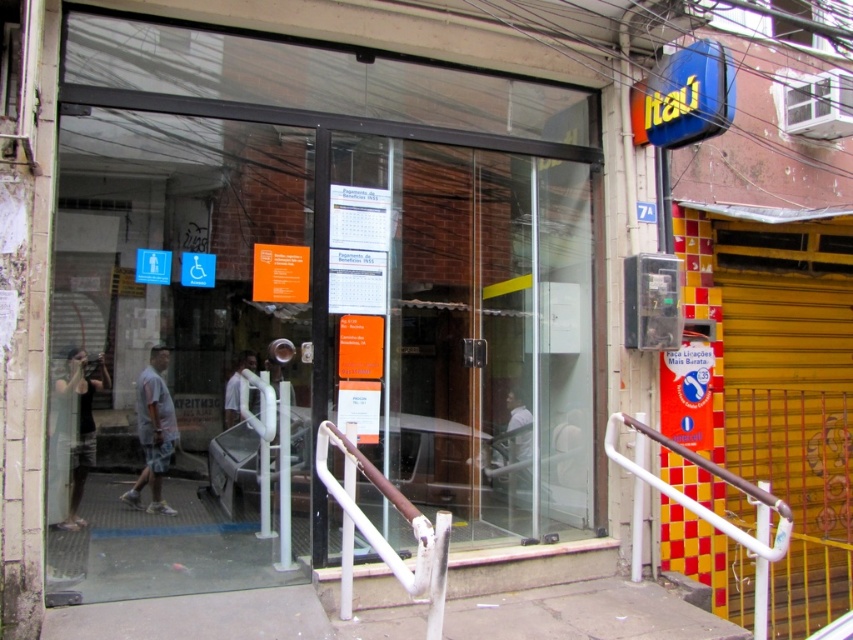
Question: Is white metal handrail at lower right positioned in front of white matte shirt at center?

Choices:
 (A) no
 (B) yes

Answer: (B)

Question: Is transparent glass door at center above white metal handrail at lower right?

Choices:
 (A) no
 (B) yes

Answer: (B)

Question: Which of the following is the closest to the observer?

Choices:
 (A) gray cotton shorts at lower left
 (B) white metal handrail at lower right

Answer: (B)

Question: Which of the following is the closest to the observer?

Choices:
 (A) click(x=151, y=376)
 (B) click(x=223, y=397)

Answer: (A)

Question: Does transparent glass door at center appear on the right side of white metal handrail at lower right?

Choices:
 (A) yes
 (B) no

Answer: (B)

Question: Estimate the real-world distances between objects in this image. Which object is farther from the matte black shirt at left?

Choices:
 (A) transparent glass door at center
 (B) gray cotton shorts at lower left

Answer: (A)